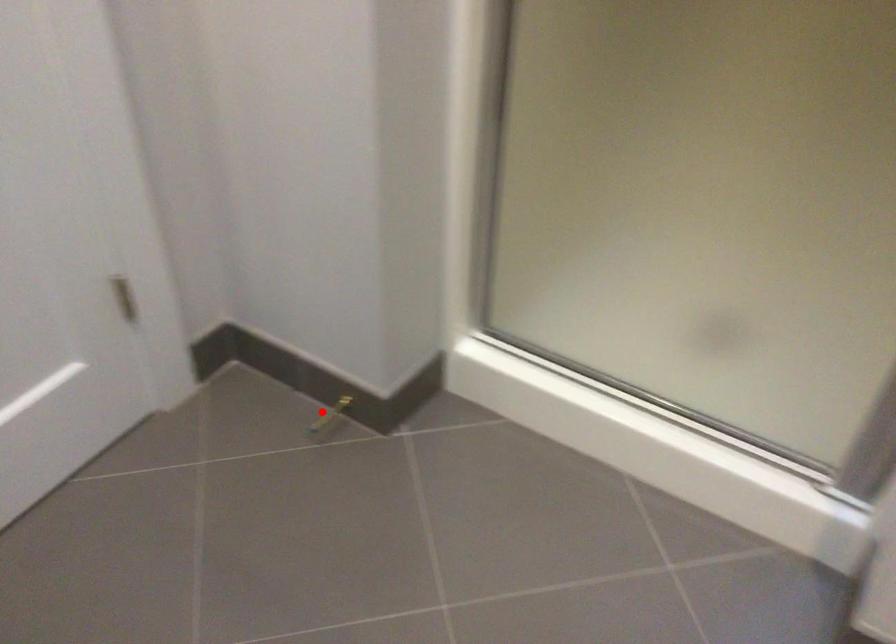
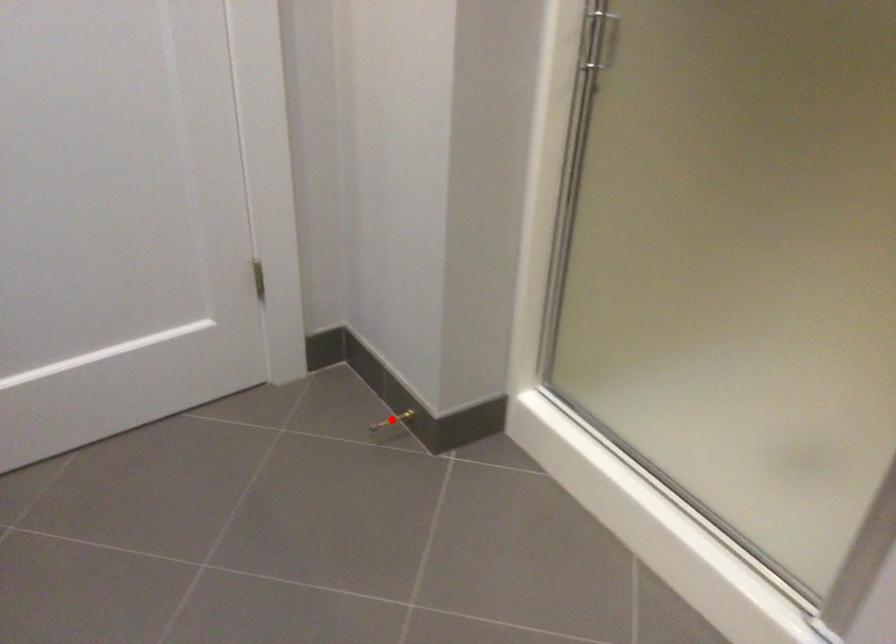
I am providing you with two images of the same scene from different viewpoints. A red point is marked on the first image and another point is marked on the second image. Are the points marked in image1 and image2 representing the same 3D position?

Yes